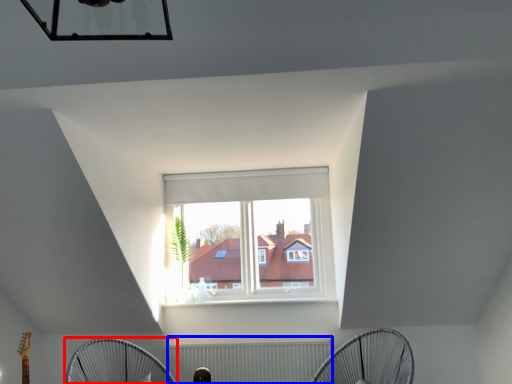
Question: Which object appears farthest to the camera in this image, mechanical fan (highlighted by a red box) or radiator (highlighted by a blue box)?

Choices:
 (A) mechanical fan
 (B) radiator

Answer: (B)